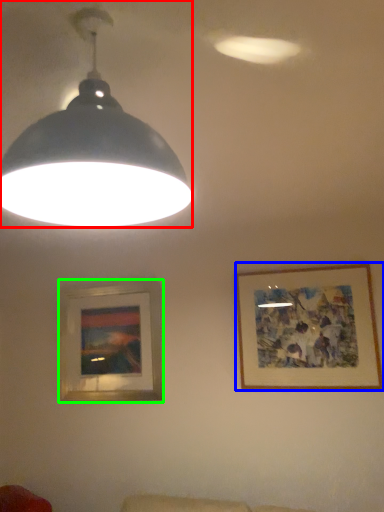
Question: Which is nearer to the lamp (highlighted by a red box)? picture frame (highlighted by a blue box) or picture frame (highlighted by a green box).

Choices:
 (A) picture frame
 (B) picture frame

Answer: (A)